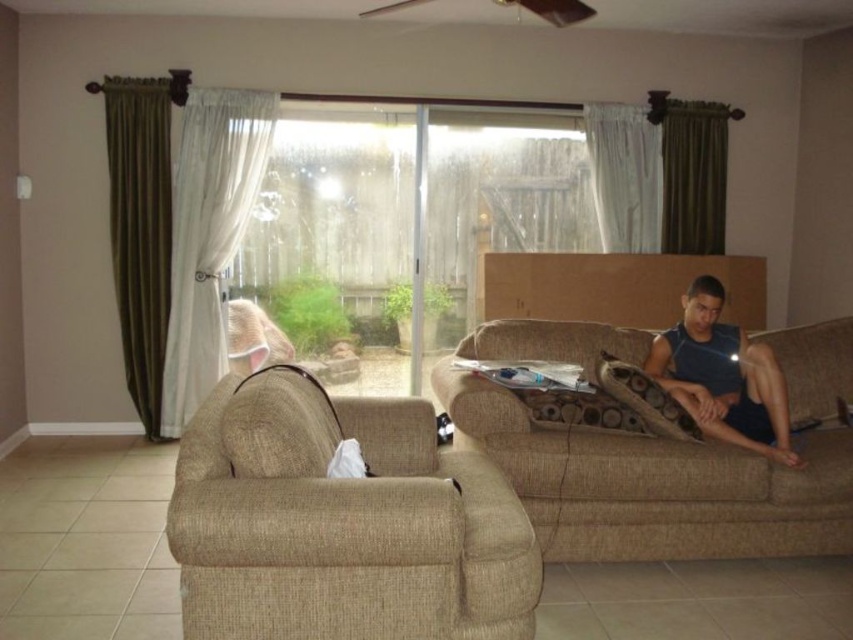
Question: Does beige fabric armchair at left appear on the left side of beige fabric couch at right?

Choices:
 (A) no
 (B) yes

Answer: (B)

Question: Estimate the real-world distances between objects in this image. Which object is closer to the beige fabric couch at right?

Choices:
 (A) matte plastic magazine at center
 (B) dark blue tank top at right

Answer: (B)

Question: Among these objects, which one is nearest to the camera?

Choices:
 (A) beige fabric armchair at left
 (B) matte plastic magazine at center
 (C) dark blue tank top at right

Answer: (A)

Question: Can you confirm if beige fabric couch at right is positioned to the right of dark blue tank top at right?

Choices:
 (A) no
 (B) yes

Answer: (A)

Question: Which of the following is the farthest from the observer?

Choices:
 (A) beige fabric couch at right
 (B) dark blue tank top at right
 (C) beige fabric armchair at left

Answer: (B)

Question: Is dark blue tank top at right further to camera compared to matte plastic magazine at center?

Choices:
 (A) no
 (B) yes

Answer: (A)